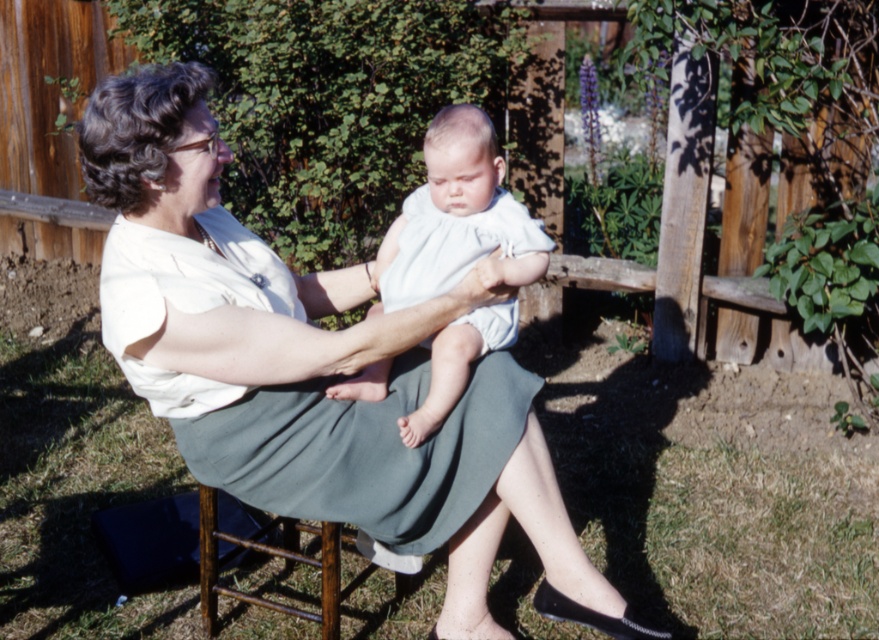
You are a fashion designer who wants to place two dresses in a photo shoot. You have a light blue cotton dress at center and a white cotton dress at center. The camera is positioned to capture both dresses in the frame. If the minimum required distance between the dresses for proper framing is 25 centimeters, will the current placement work?

The distance between the light blue cotton dress at center and the white cotton dress at center is 24.44 centimeters, which is less than the required 25 centimeters. Therefore, the current placement will not work for proper framing.

In the scene shown: You are a tailor measuring fabric for alterations. You need to determine if a 10 inch long fabric strip is sufficient to bridge the gap between the white cotton blouse at upper center and the white cotton dress at center. Can you confirm if the fabric strip will be long enough?

The distance between the white cotton blouse at upper center and the white cotton dress at center is 9.03 inches. A 10 inch fabric strip is longer than the required distance, so it will be sufficient to bridge the gap between the white cotton blouse at upper center and the white cotton dress at center.